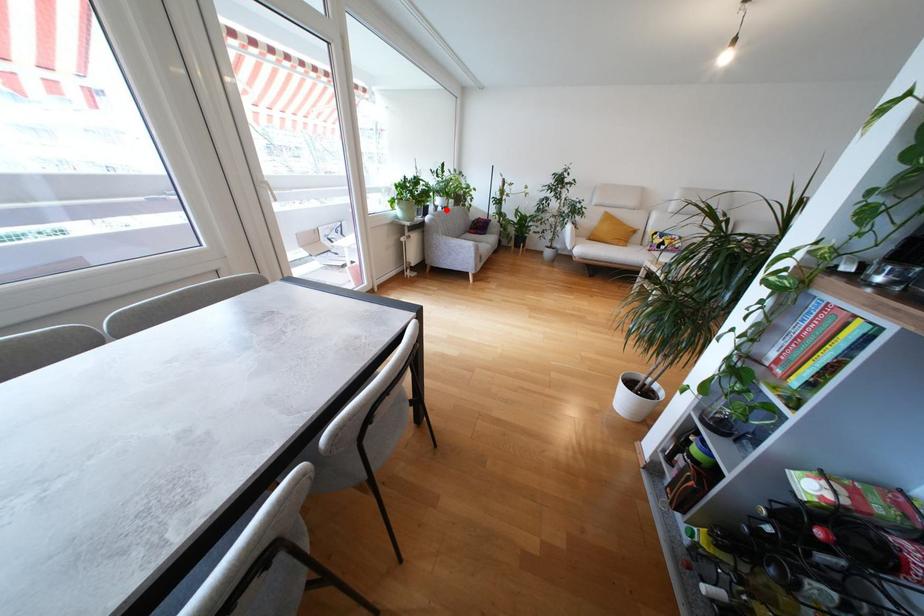
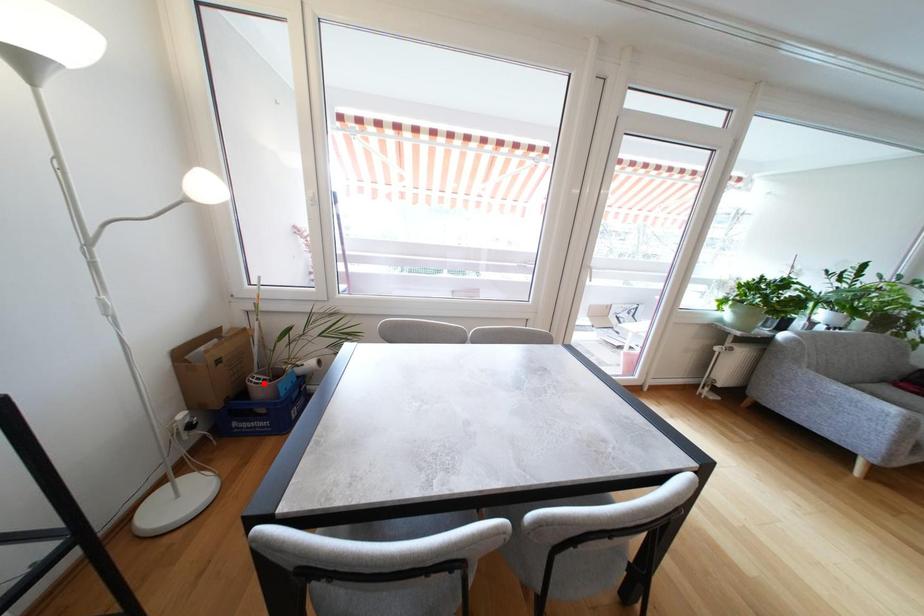
I am providing you with two images of the same scene from different viewpoints. A red point is marked on the first image and another point is marked on the second image. Is the red point in image1 aligned with the point shown in image2?

No